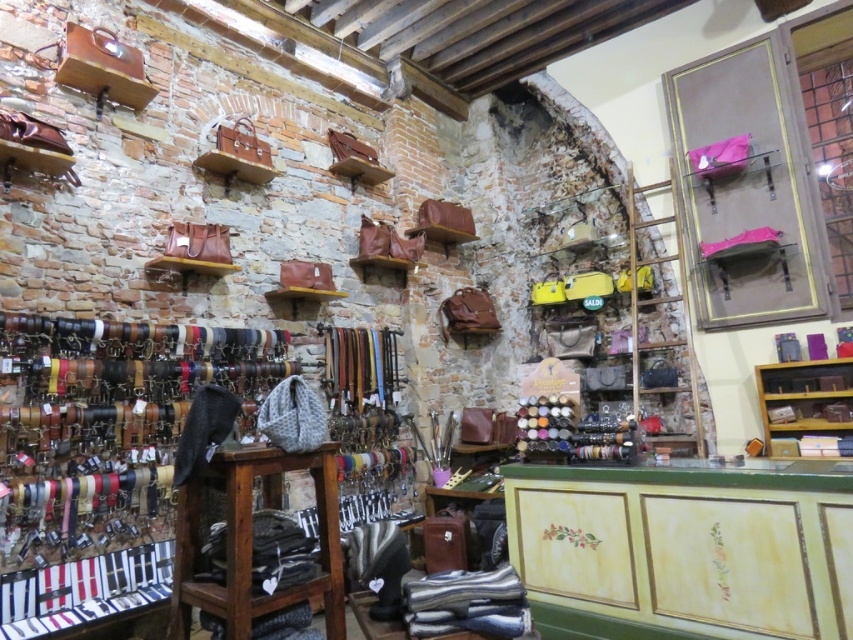
You are a customer in the shop and want to reach an item placed on the wooden shelf at right. You are 1.7 meters tall and the item is at the highest point you can reach. There is a wooden stool at center nearby. Can you use the stool to safely reach the item?

The wooden stool at center is taller than the wooden shelf at right. Since the stool is taller, standing on it would allow you to reach higher than the shelf itself. However, since the item is already at your maximum reach height without the stool, using the stool might put you at risk of overreaching and losing balance. It is safer not to use the stool in this situation.

You are a customer in the shop and want to sit down to try on a belt. There is a wooden stool at center and a wooden shelf at right. Which one can you sit on?

The wooden stool at center is bigger than wooden shelf at right, so you can sit on the wooden stool at center.